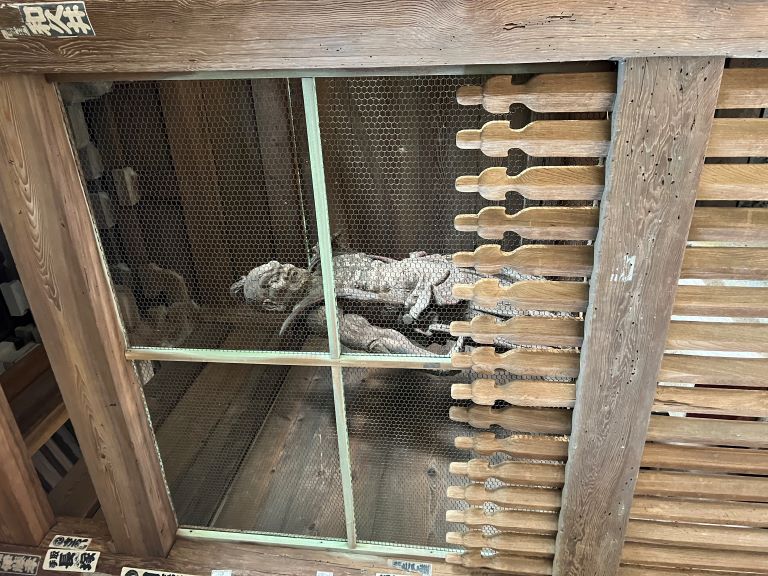
You are a GUI agent. You are given a task and a screenshot of the screen. Output one action in this format:
    pyautogui.click(x=<x>, y=<y>)
    Task: Click on the back wall
    
    Given the screenshot: What is the action you would take?
    pyautogui.click(x=574, y=276), pyautogui.click(x=494, y=386)